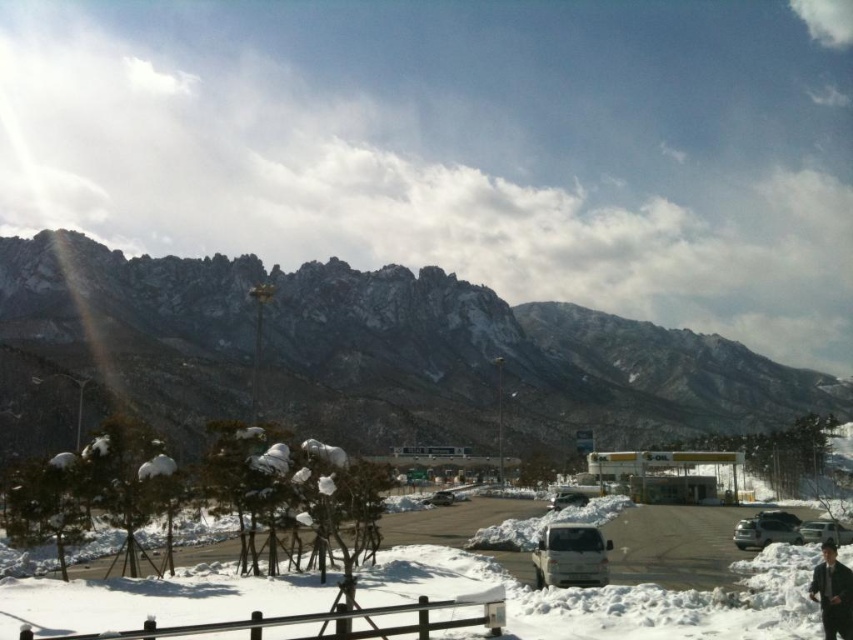
Which of these two, rocky gray mountain at upper left or white matte van at lower right, stands taller?

rocky gray mountain at upper left is taller.

From the picture: Can you confirm if rocky gray mountain at upper left is thinner than white matte van at lower right?

Incorrect, rocky gray mountain at upper left's width is not less than white matte van at lower right's.

Who is more forward, (334, 368) or (801, 536)?

Positioned in front is point (801, 536).

The height and width of the screenshot is (640, 853). I want to click on rocky gray mountain at upper left, so tap(383, 353).

Which of these two, rocky gray mountain at upper left or sleek silver sedan at center, stands shorter?

Standing shorter between the two is sleek silver sedan at center.

Does rocky gray mountain at upper left appear over sleek silver sedan at center?

Yes.

Is point (241, 349) farther from viewer compared to point (764, 518)?

Yes, it is behind point (764, 518).

The image size is (853, 640). What are the coordinates of `rocky gray mountain at upper left` in the screenshot? It's located at (383, 353).

Is point (757, 516) in front of point (426, 500)?

That is True.

Find the location of a particular element. The width and height of the screenshot is (853, 640). sleek silver sedan at center is located at coordinates (779, 516).